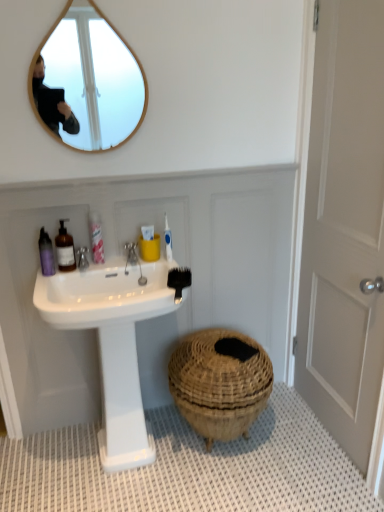
Question: From the image's perspective, is silver metallic faucet at upper center on top of white glossy sink at center?

Choices:
 (A) yes
 (B) no

Answer: (A)

Question: Does silver metallic faucet at upper center have a lesser width compared to white glossy sink at center?

Choices:
 (A) no
 (B) yes

Answer: (B)

Question: Considering the relative positions of silver metallic faucet at upper center and white glossy sink at center in the image provided, is silver metallic faucet at upper center behind white glossy sink at center?

Choices:
 (A) yes
 (B) no

Answer: (A)

Question: From a real-world perspective, is silver metallic faucet at upper center located higher than white glossy sink at center?

Choices:
 (A) no
 (B) yes

Answer: (B)

Question: Is there a large distance between silver metallic faucet at upper center and white glossy sink at center?

Choices:
 (A) yes
 (B) no

Answer: (B)

Question: Is brown woven basket at lower center in front of or behind silver metallic faucet at sink left in the image?

Choices:
 (A) behind
 (B) front

Answer: (B)

Question: Considering the positions of point (192, 374) and point (81, 268), is point (192, 374) closer or farther from the camera than point (81, 268)?

Choices:
 (A) farther
 (B) closer

Answer: (A)

Question: Would you say brown woven basket at lower center is to the left or to the right of silver metallic faucet at sink left in the picture?

Choices:
 (A) left
 (B) right

Answer: (B)

Question: Considering the positions of brown woven basket at lower center and silver metallic faucet at sink left in the image, is brown woven basket at lower center taller or shorter than silver metallic faucet at sink left?

Choices:
 (A) tall
 (B) short

Answer: (A)

Question: Is pink plastic bottle at upper left, the first toiletry viewed from the right, taller or shorter than white matte door at right?

Choices:
 (A) tall
 (B) short

Answer: (B)

Question: Is pink plastic bottle at upper left, the 3th toiletry in the left-to-right sequence, in front of or behind white matte door at right in the image?

Choices:
 (A) front
 (B) behind

Answer: (B)

Question: From a real-world perspective, is pink plastic bottle at upper left, the first toiletry viewed from the right, above or below white matte door at right?

Choices:
 (A) below
 (B) above

Answer: (B)

Question: Looking at the image, does pink plastic bottle at upper left, the 3th toiletry in the left-to-right sequence, seem bigger or smaller compared to white matte door at right?

Choices:
 (A) small
 (B) big

Answer: (A)

Question: From the image's perspective, relative to matte purple bottle at upper left, which is the 1th toiletry from left to right, is translucent glass soap dispenser at left, which ranks as the second toiletry in left-to-right order, above or below?

Choices:
 (A) above
 (B) below

Answer: (A)

Question: Considering their positions, is translucent glass soap dispenser at left, placed as the 2th toiletry when sorted from right to left, located in front of or behind matte purple bottle at upper left, which is the 1th toiletry from left to right?

Choices:
 (A) front
 (B) behind

Answer: (B)